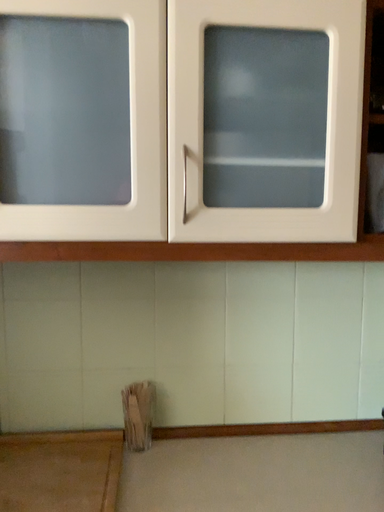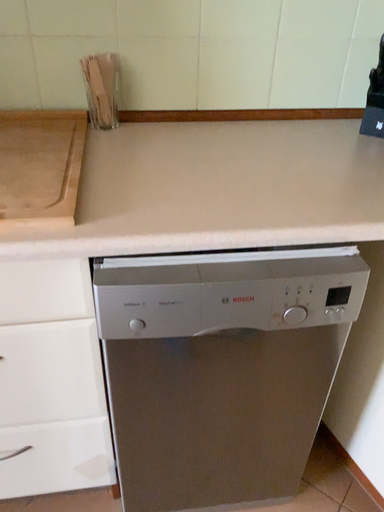
Question: How did the camera likely rotate when shooting the video?

Choices:
 (A) rotated upward
 (B) rotated downward

Answer: (B)